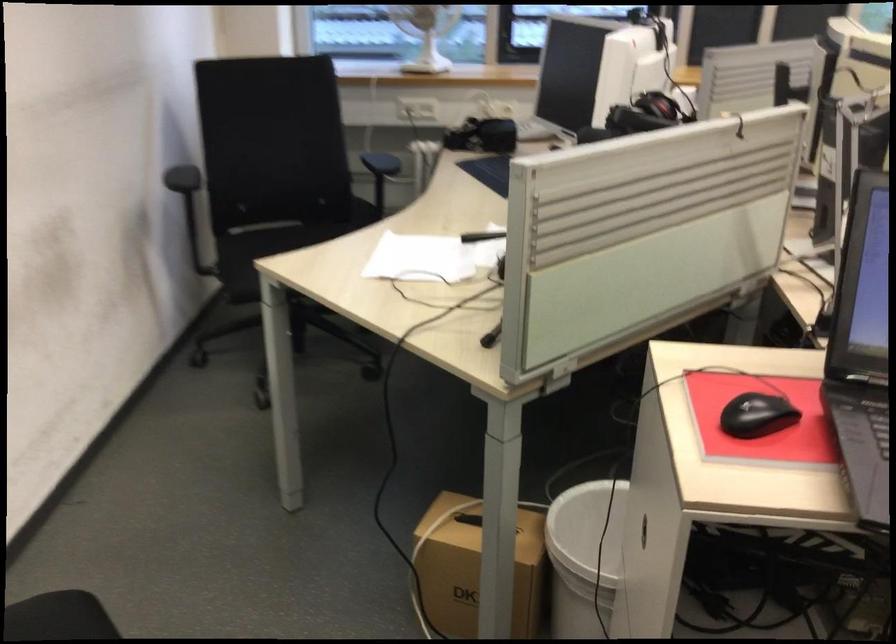
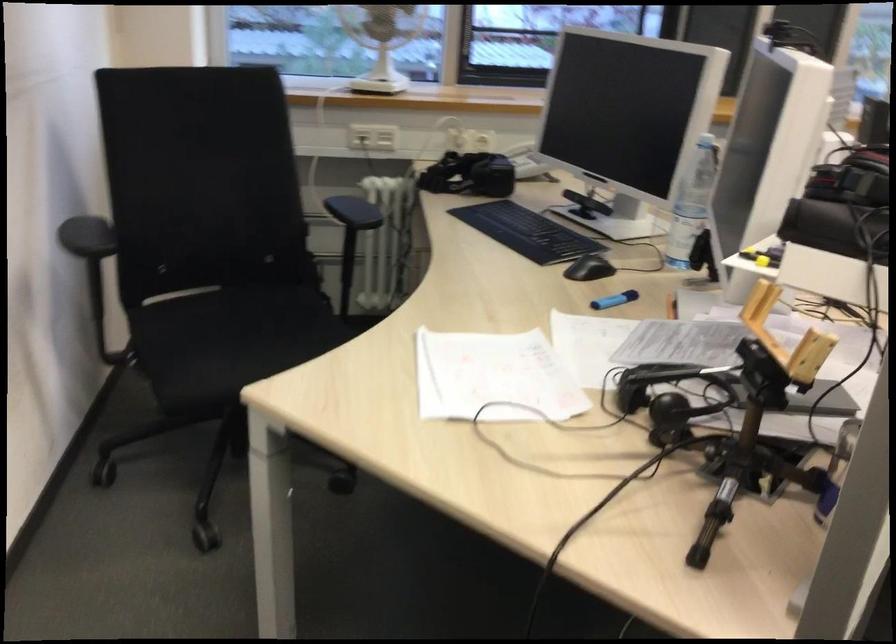
Find the pixel in the second image that matches point 426,108 in the first image.

(385, 138)